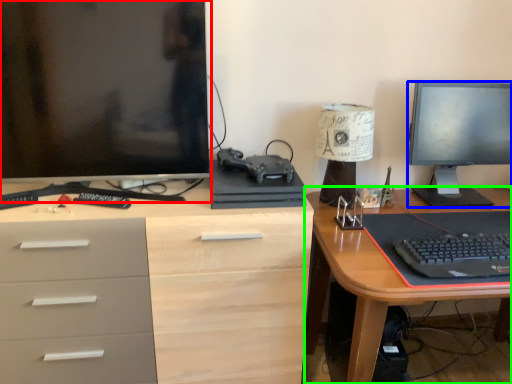
Question: Which object is positioned closest to computer monitor (highlighted by a red box)? Select from television (highlighted by a blue box) and desk (highlighted by a green box).

Choices:
 (A) television
 (B) desk

Answer: (B)